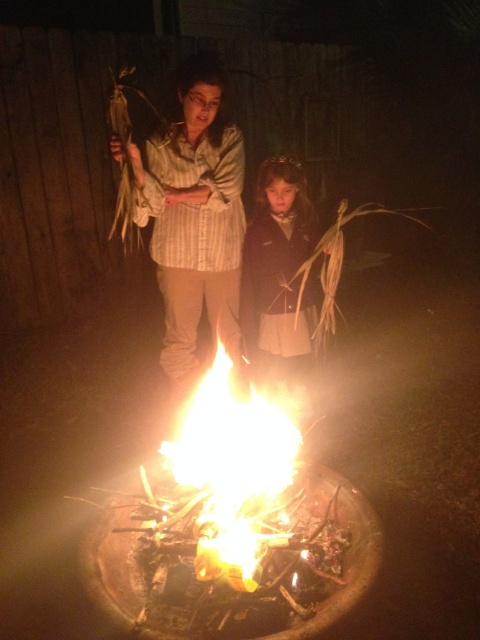
Question: Among these objects, which one is nearest to the camera?

Choices:
 (A) dark brown wool coat at center
 (B) bright yellow-orange flames at center
 (C) striped cotton shirt at center

Answer: (B)

Question: Which of the following is the farthest from the observer?

Choices:
 (A) bright yellow-orange flames at center
 (B) striped cotton shirt at center

Answer: (B)

Question: Can you confirm if bright yellow-orange flames at center is thinner than dark brown wool coat at center?

Choices:
 (A) yes
 (B) no

Answer: (B)

Question: From the image, what is the correct spatial relationship of striped cotton shirt at center in relation to bright yellow-orange flames at center?

Choices:
 (A) below
 (B) above

Answer: (B)

Question: In this image, where is striped cotton shirt at center located relative to dark brown wool coat at center?

Choices:
 (A) above
 (B) below

Answer: (A)

Question: Estimate the real-world distances between objects in this image. Which object is farther from the dark brown wool coat at center?

Choices:
 (A) striped cotton shirt at center
 (B) bright yellow-orange flames at center

Answer: (B)